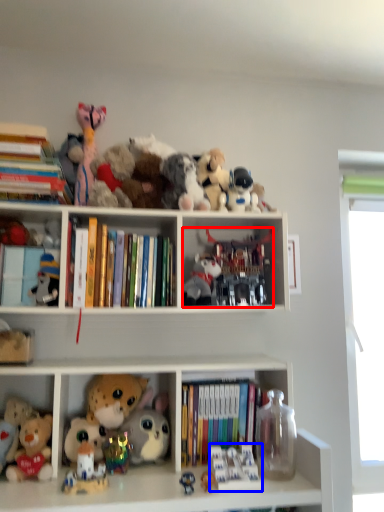
Question: Which object appears closest to the camera in this image, toy (highlighted by a red box) or toy (highlighted by a blue box)?

Choices:
 (A) toy
 (B) toy

Answer: (B)